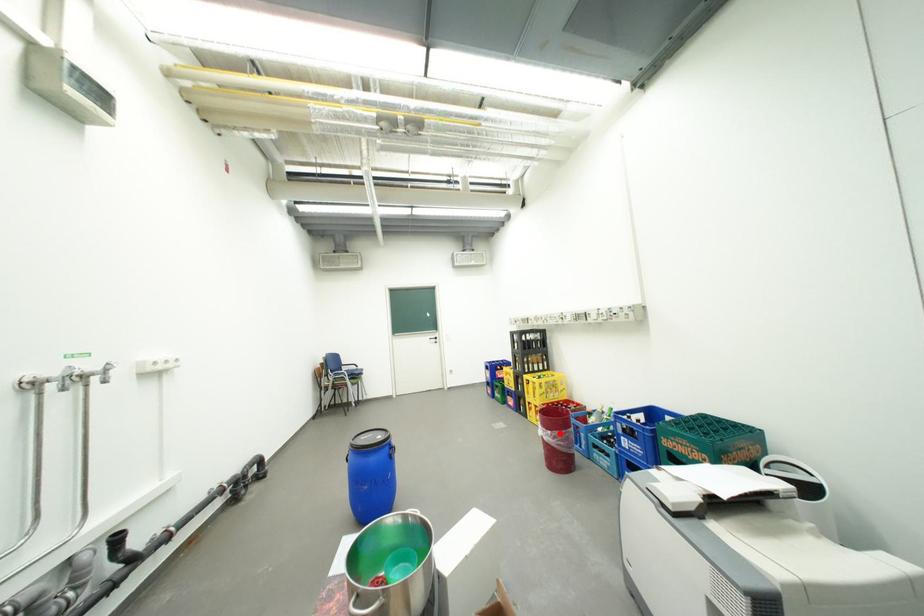
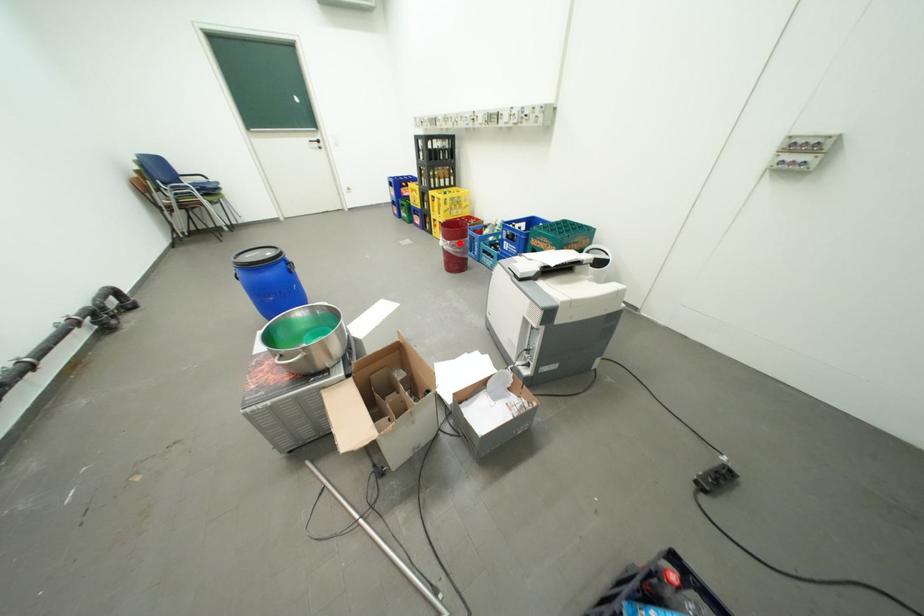
I am providing you with two images of the same scene from different viewpoints. A red point is marked on the first image and another point is marked on the second image. Does the point marked in image1 correspond to the same location as the one in image2?

Yes